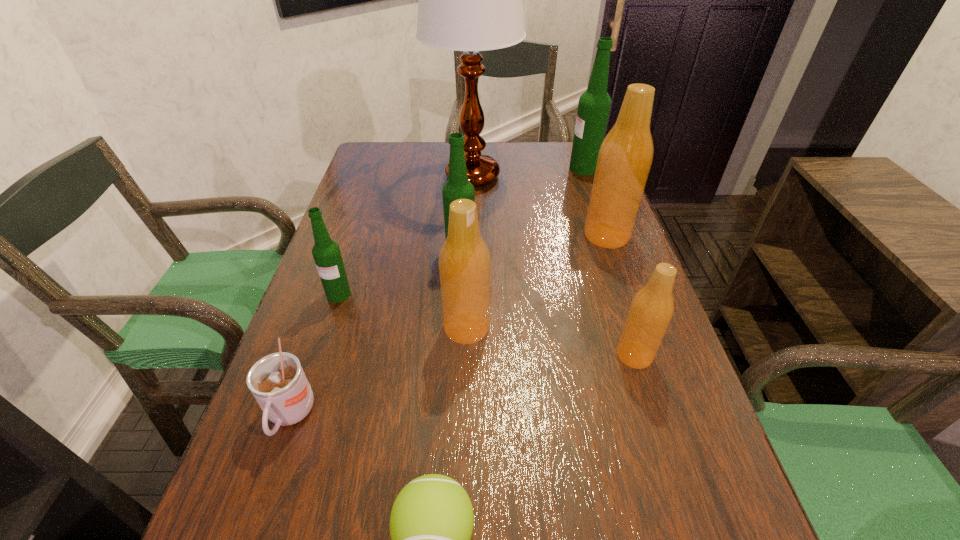
You are a GUI agent. You are given a task and a screenshot of the screen. Output one action in this format:
    pyautogui.click(x=<x>, y=<y>)
    Task: Click on the smallest tan beer bottle
    
    Given the screenshot: What is the action you would take?
    pyautogui.click(x=652, y=307)

You are a GUI agent. You are given a task and a screenshot of the screen. Output one action in this format:
    pyautogui.click(x=<x>, y=<y>)
    Task: Click on the cup
    The height and width of the screenshot is (540, 960).
    Given the screenshot: What is the action you would take?
    pyautogui.click(x=277, y=381)

You are a GUI agent. You are given a task and a screenshot of the screen. Output one action in this format:
    pyautogui.click(x=<x>, y=<y>)
    Task: Click on the second nearest object
    
    Given the screenshot: What is the action you would take?
    pyautogui.click(x=277, y=381)

Where is `vacant region located on the front of the tallest object`? The height and width of the screenshot is (540, 960). vacant region located on the front of the tallest object is located at coordinates (471, 210).

Identify the location of free location located on the label of the rightmost green beer bottle. (470, 168).

Identify the location of free space located 0.190m on the label of the rightmost green beer bottle. The width and height of the screenshot is (960, 540). (509, 168).

You are a GUI agent. You are given a task and a screenshot of the screen. Output one action in this format:
    pyautogui.click(x=<x>, y=<y>)
    Task: Click on the free space located 0.330m on the label of the rightmost green beer bottle
    
    Given the screenshot: What is the action you would take?
    pyautogui.click(x=465, y=168)

Locate an element on the screen. This screenshot has height=540, width=960. blank space located 0.400m on the front of the farthest tan beer bottle is located at coordinates click(660, 390).

At what (x,y) coordinates should I click in order to perform the action: click on free space located on the label of the second nearest green beer bottle. Please return your answer as a coordinate pair (x, y). This screenshot has width=960, height=540. Looking at the image, I should click on (552, 249).

I want to click on vacant region located 0.200m on the right of the leftmost tan beer bottle, so click(x=587, y=328).